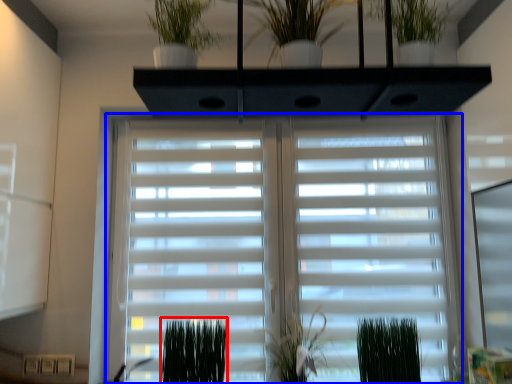
Question: Which of the following is the closest to the observer, plant (highlighted by a red box) or window blind (highlighted by a blue box)?

Choices:
 (A) plant
 (B) window blind

Answer: (A)